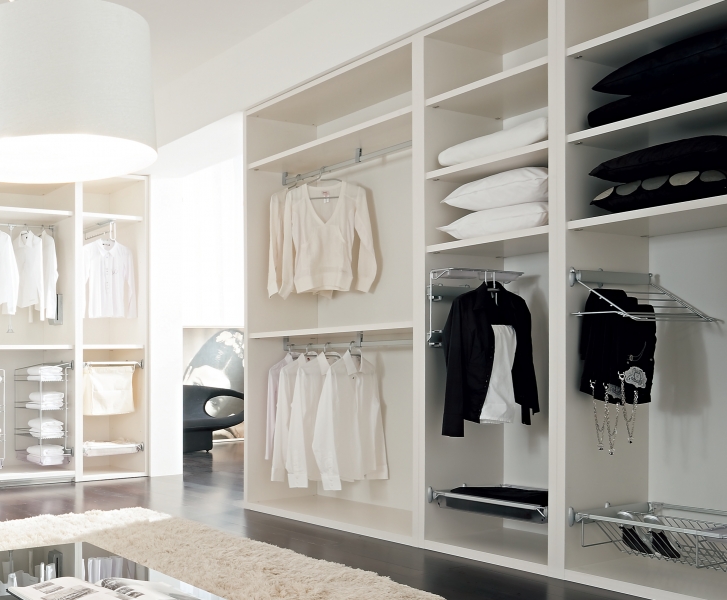
Where is `white pillows`? This screenshot has height=600, width=727. white pillows is located at coordinates (493, 190), (494, 216).